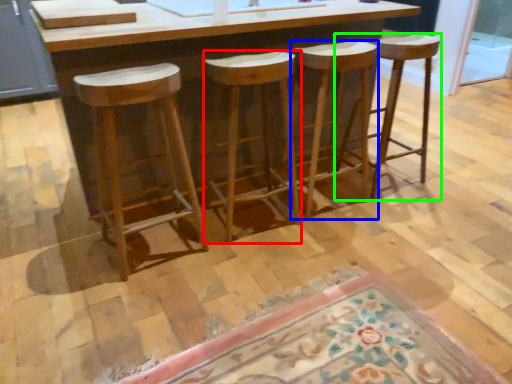
Question: Which object is positioned farthest from stool (highlighted by a red box)? Select from stool (highlighted by a blue box) and stool (highlighted by a green box).

Choices:
 (A) stool
 (B) stool

Answer: (B)